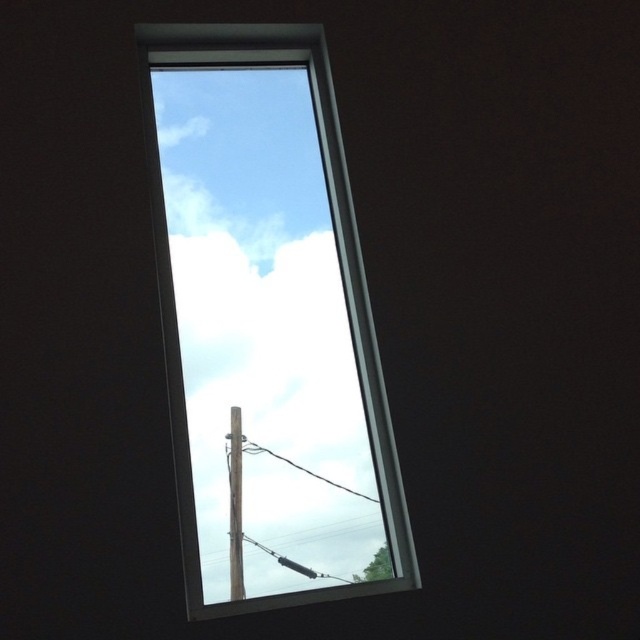
Can you confirm if transparent glass window at upper center is smaller than smooth metallic pole at center?

Actually, transparent glass window at upper center might be larger than smooth metallic pole at center.

Where is `transparent glass window at upper center`? The width and height of the screenshot is (640, 640). transparent glass window at upper center is located at coordinates (268, 321).